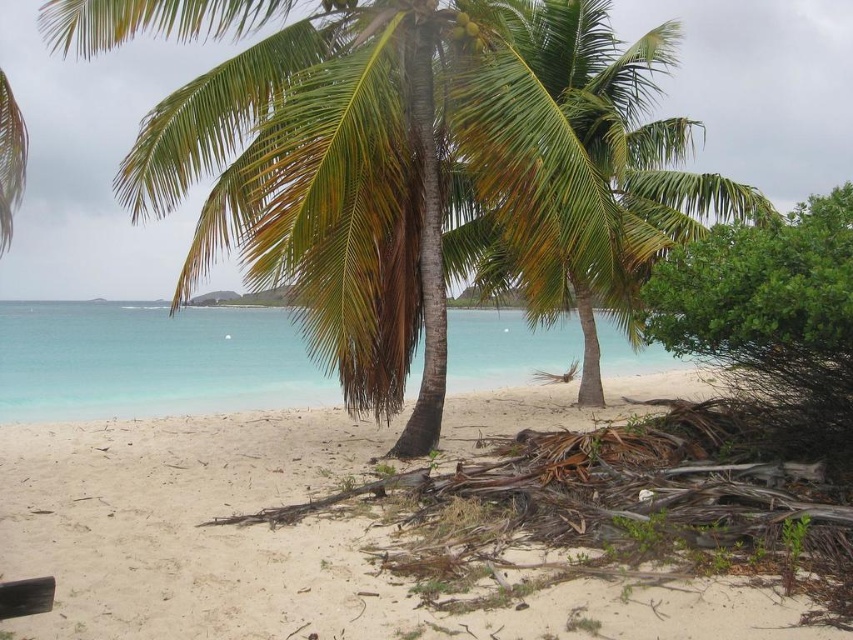
Between point (509, 100) and point (244, 344), which one is positioned behind?

Positioned behind is point (244, 344).

Who is taller, green leafy coconut tree at center or clear blue water at center?

With more height is green leafy coconut tree at center.

Which is in front, point (496, 1) or point (212, 406)?

Point (496, 1) is in front.

The height and width of the screenshot is (640, 853). I want to click on green leafy coconut tree at center, so coord(425,172).

Based on the photo, measure the distance between white sandy beach at lower left and clear blue water at center.

The distance of white sandy beach at lower left from clear blue water at center is 6.07 meters.

Does point (316, 493) come farther from viewer compared to point (41, 384)?

That is False.

Find the location of a particular element. This screenshot has width=853, height=640. white sandy beach at lower left is located at coordinates (277, 545).

Which of these two, green leafy coconut tree at center or white sandy beach at lower left, stands shorter?

With less height is white sandy beach at lower left.

Can you confirm if green leafy coconut tree at center is smaller than white sandy beach at lower left?

No, green leafy coconut tree at center is not smaller than white sandy beach at lower left.

Which is in front, point (554, 8) or point (355, 432)?

Point (355, 432) is more forward.

In order to click on green leafy coconut tree at center in this screenshot , I will do `click(425, 172)`.